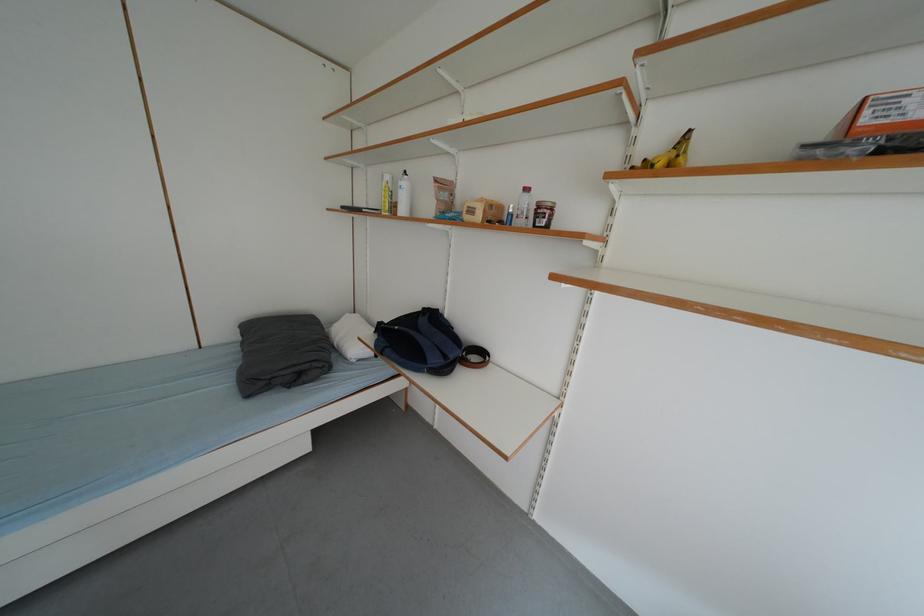
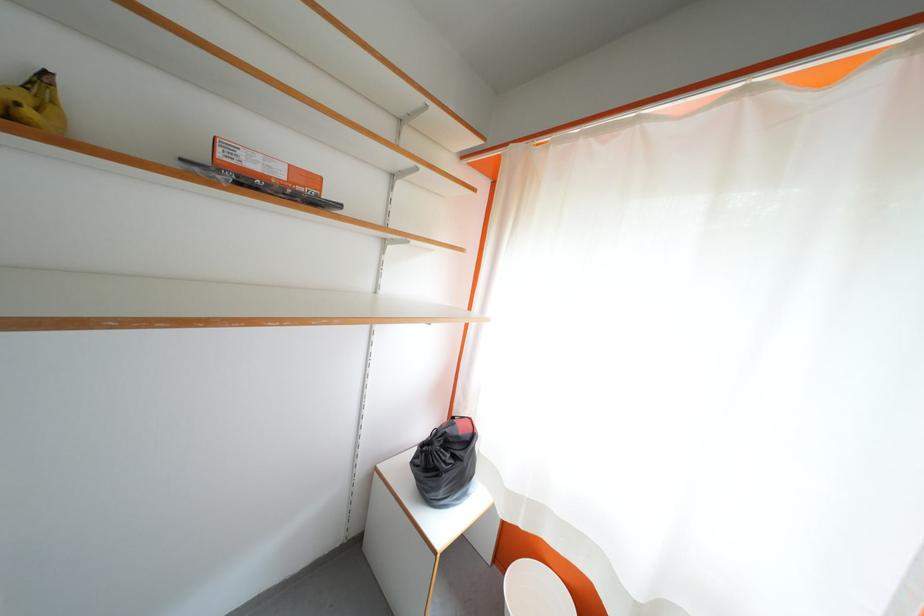
Locate, in the second image, the point that corresponds to the point at 689,161 in the first image.

(38, 115)